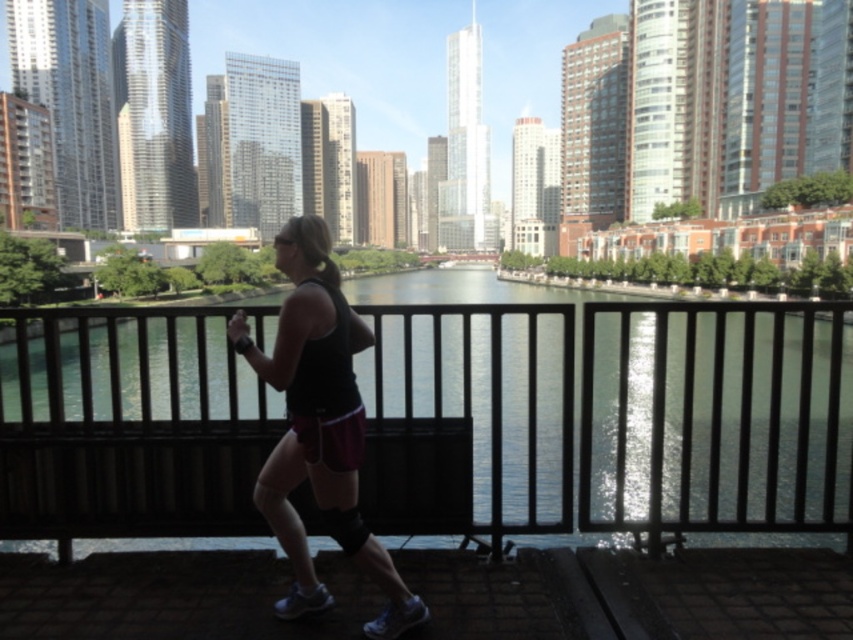
Where is `green glass water at center`? The image size is (853, 640). green glass water at center is located at coordinates (602, 410).

Who is positioned more to the right, green glass water at center or black matte tank top at center?

From the viewer's perspective, green glass water at center appears more on the right side.

Which is behind, point (659, 332) or point (329, 259)?

The point (659, 332) is more distant.

The width and height of the screenshot is (853, 640). Identify the location of green glass water at center. (602, 410).